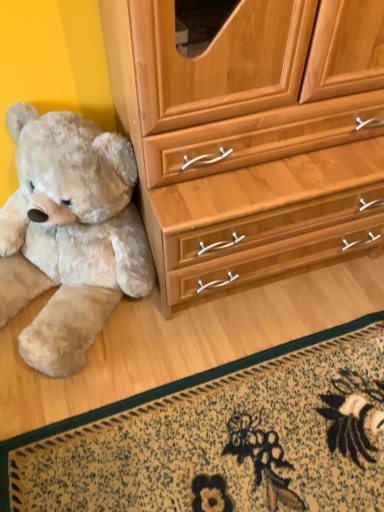
Identify the location of vacant space to the right of fluffy beige teddy bear at left. This screenshot has width=384, height=512. (238, 357).